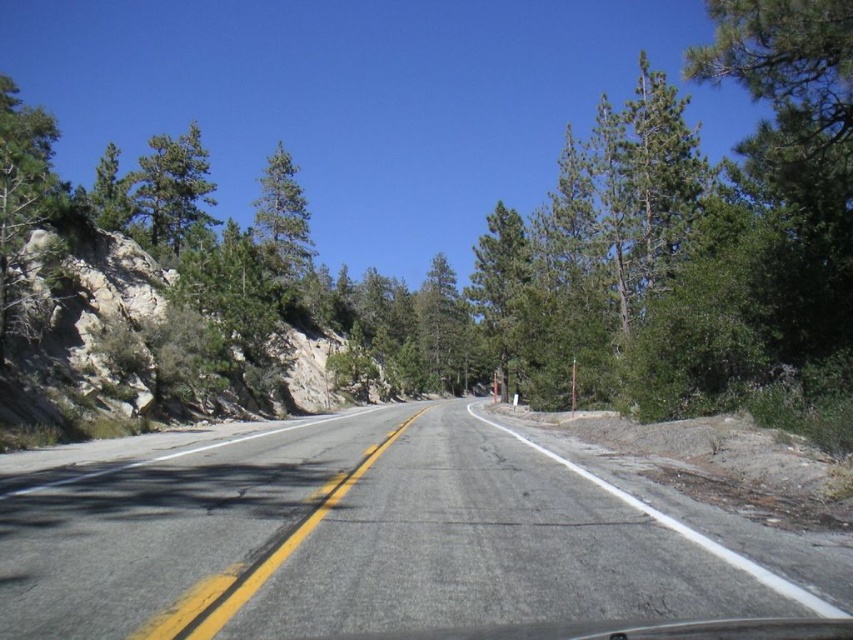
You are a hiker standing at the starting point of the trail. You notice a green matte tree at upper left in the distance. Can you determine its exact location based on the coordinates provided?

The green matte tree at upper left is located at point (171, 189).

You are standing at the point marked as point (376,536). Which direction should you walk to reach the asphalt road at center?

A: The asphalt road at center is located at point (376,536), so you are already standing on the asphalt road at center.

You are driving a car with a length of 4.5 meters. You want to safely turn around on the asphalt road at center. Is the road long enough for your car to turn around?

The distance between the asphalt road at center and the camera is 3.84 meters, which is shorter than the car length of 4.5 meters. Therefore, the road is not long enough for the car to turn around safely.